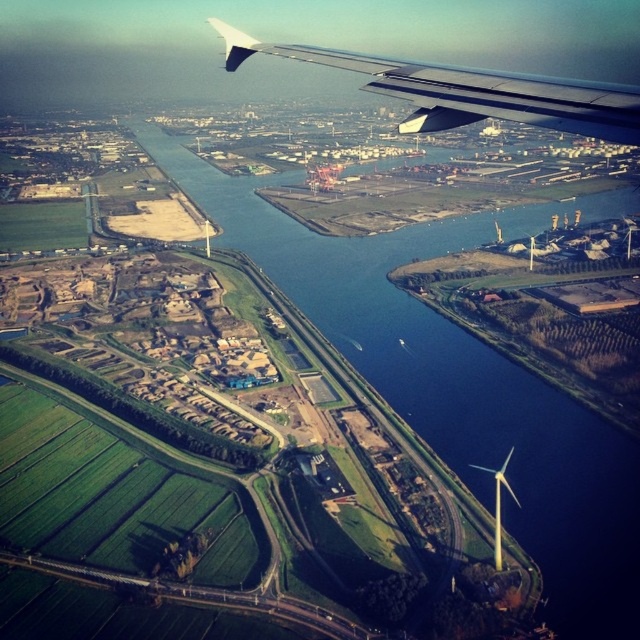
You are a pilot observing the view from the airplane window. You notice the blue water at lower left and the metallic gray wing at upper right. Which object appears taller in the image?

The blue water at lower left appears taller than the metallic gray wing at upper right based on the spatial relationship in the scene.

You are a passenger looking out the airplane window and see two points marked in the landscape. The first point is at coordinate point [608,588] and the second is at point [538,108]. Which point is closer to your viewpoint?

Point [538,108] is closer to your viewpoint because it is less further to the camera than point [608,588].